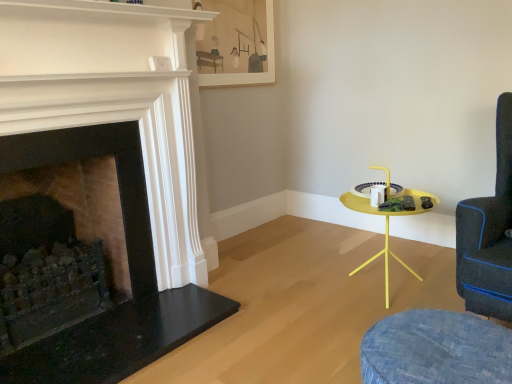
The image size is (512, 384). What are the coordinates of `free point above denim swivel chair at lower right, the 1th swivel chair when ordered from left to right (from a real-world perspective)` in the screenshot? It's located at (426, 340).